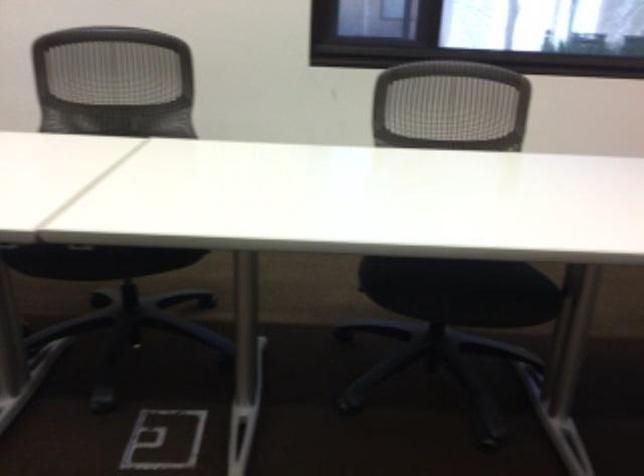
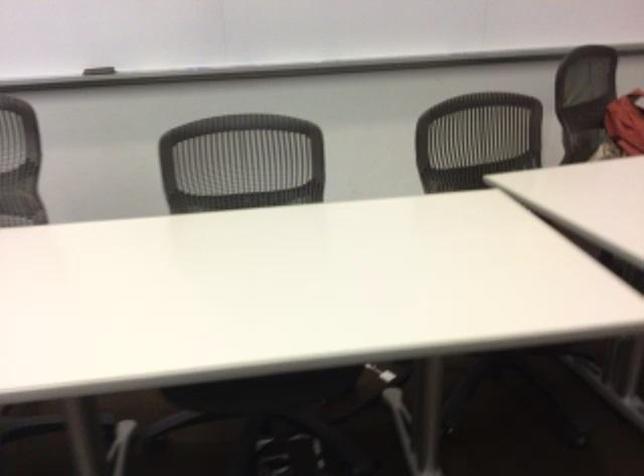
Based on the continuous images, in which direction is the camera rotating?

The camera's rotation is toward right-down.